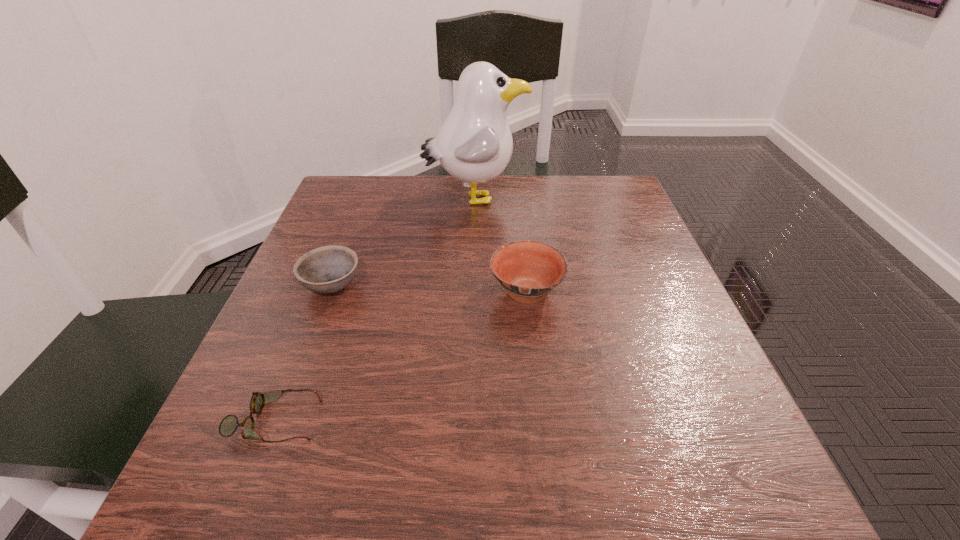
The height and width of the screenshot is (540, 960). What are the coordinates of `gull` in the screenshot? It's located at (474, 145).

At what (x,y) coordinates should I click in order to perform the action: click on the tallest object. Please return your answer as a coordinate pair (x, y). Looking at the image, I should click on (474, 145).

Find the location of a particular element. This screenshot has height=540, width=960. the right bowl is located at coordinates (528, 270).

At what (x,y) coordinates should I click in order to perform the action: click on the taller bowl. Please return your answer as a coordinate pair (x, y). The width and height of the screenshot is (960, 540). Looking at the image, I should click on (528, 270).

Find the location of a particular element. the shorter bowl is located at coordinates (328, 269).

The height and width of the screenshot is (540, 960). In order to click on the second shortest object in this screenshot , I will do tap(328, 269).

Identify the location of the nearest object. (228, 426).

Where is `spectacles`? This screenshot has height=540, width=960. spectacles is located at coordinates (228, 426).

This screenshot has height=540, width=960. I want to click on vacant space located on the beak of the farthest object, so click(615, 198).

The height and width of the screenshot is (540, 960). In order to click on vacant point located on the back of the third shortest object in this screenshot , I will do `click(514, 184)`.